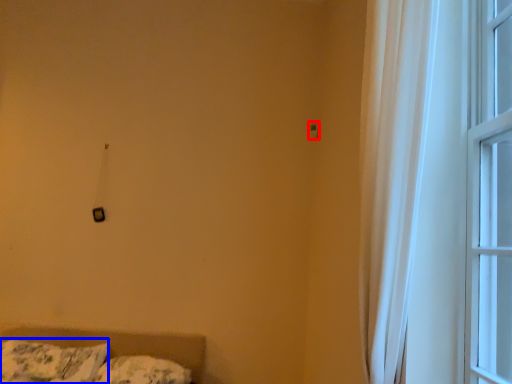
Question: Which point is further to the camera, light switch (highlighted by a red box) or pillow (highlighted by a blue box)?

Choices:
 (A) light switch
 (B) pillow

Answer: (A)